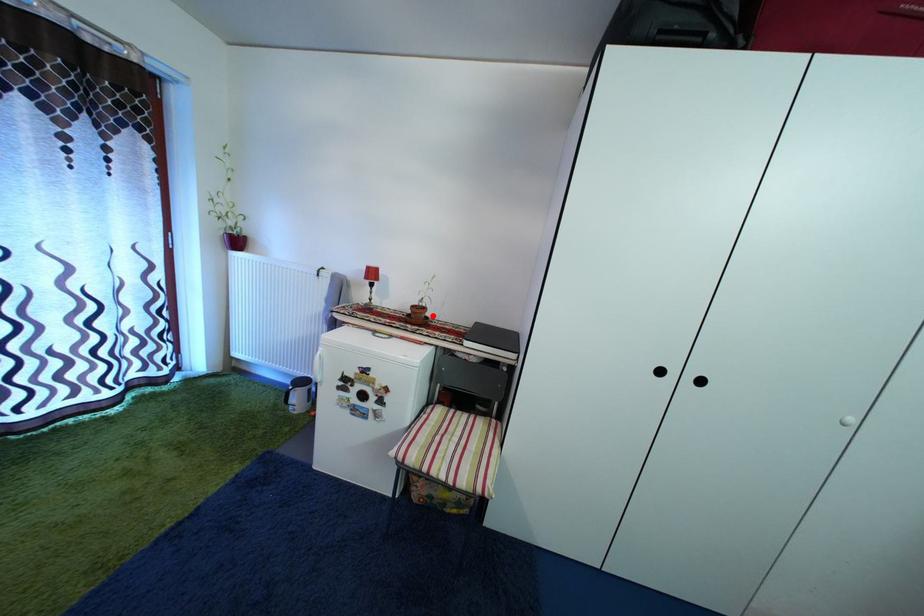
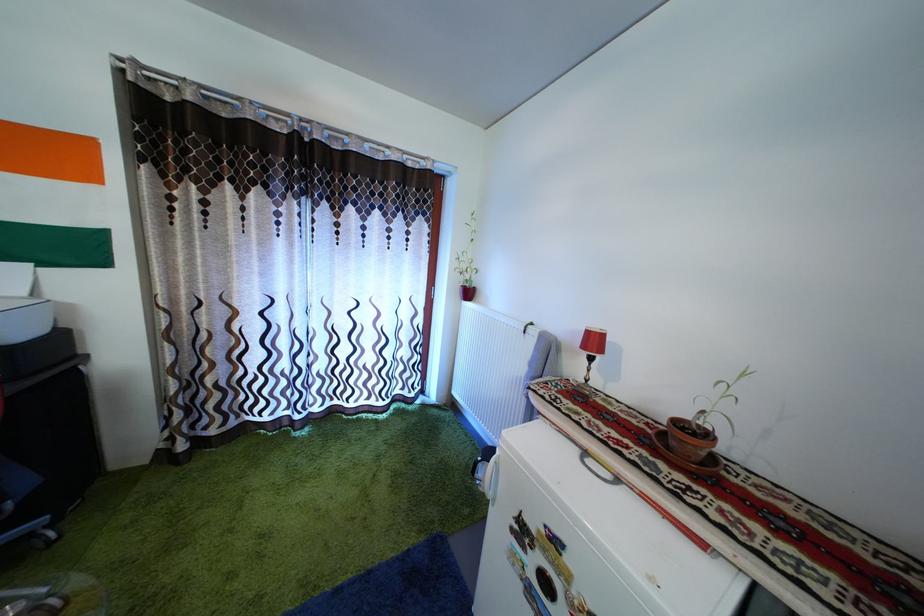
The point at the highlighted location is marked in the first image. Where is the corresponding point in the second image?

(715, 442)